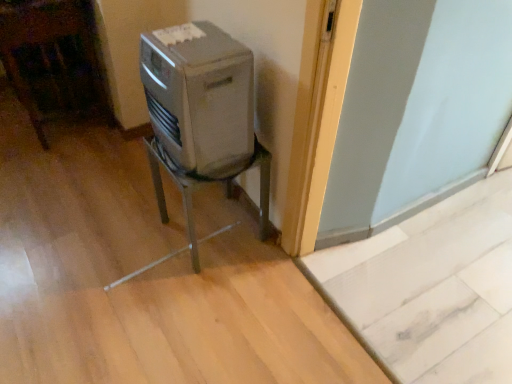
Question: Is satin silver appliance at center further to camera compared to metallic gray air conditioner at center?

Choices:
 (A) no
 (B) yes

Answer: (A)

Question: Is satin silver appliance at center completely or partially outside of metallic gray air conditioner at center?

Choices:
 (A) no
 (B) yes

Answer: (B)

Question: Is satin silver appliance at center directly adjacent to metallic gray air conditioner at center?

Choices:
 (A) yes
 (B) no

Answer: (B)

Question: Is satin silver appliance at center smaller than metallic gray air conditioner at center?

Choices:
 (A) yes
 (B) no

Answer: (A)

Question: From a real-world perspective, does satin silver appliance at center sit lower than metallic gray air conditioner at center?

Choices:
 (A) yes
 (B) no

Answer: (B)

Question: Can you confirm if satin silver appliance at center is bigger than metallic gray air conditioner at center?

Choices:
 (A) no
 (B) yes

Answer: (A)

Question: Is metallic gray air conditioner at center outside satin silver appliance at center?

Choices:
 (A) no
 (B) yes

Answer: (B)

Question: Are metallic gray air conditioner at center and satin silver appliance at center far apart?

Choices:
 (A) no
 (B) yes

Answer: (A)

Question: Does metallic gray air conditioner at center come behind satin silver appliance at center?

Choices:
 (A) no
 (B) yes

Answer: (B)

Question: Is metallic gray air conditioner at center taller than satin silver appliance at center?

Choices:
 (A) yes
 (B) no

Answer: (A)

Question: Can you confirm if metallic gray air conditioner at center is thinner than satin silver appliance at center?

Choices:
 (A) no
 (B) yes

Answer: (A)

Question: Does metallic gray air conditioner at center touch satin silver appliance at center?

Choices:
 (A) no
 (B) yes

Answer: (A)

Question: Based on their sizes in the image, would you say metallic gray air conditioner at center is bigger or smaller than satin silver appliance at center?

Choices:
 (A) big
 (B) small

Answer: (A)